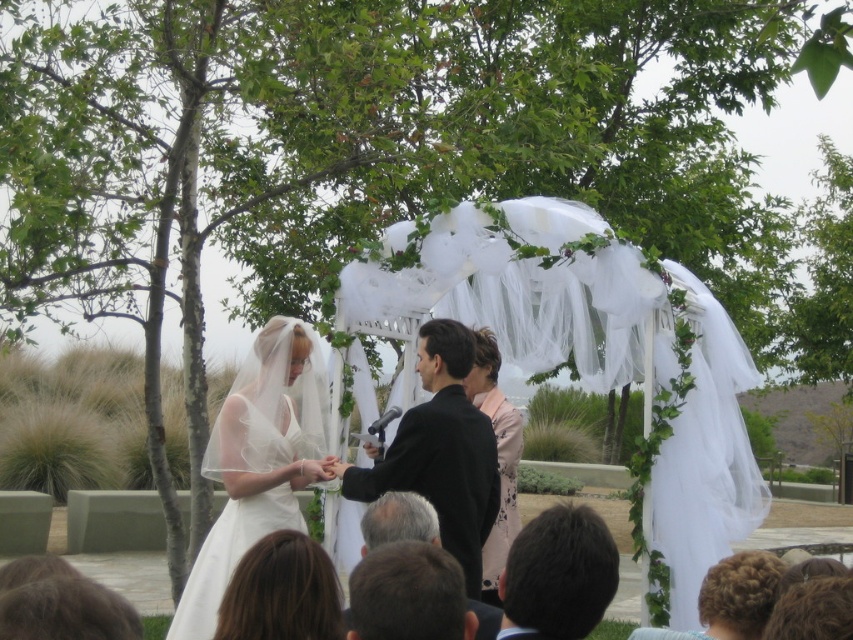
Question: In this image, where is pink floral dress at center located relative to gray hair at lower center?

Choices:
 (A) below
 (B) above

Answer: (B)

Question: Is black smooth suit at center closer to camera compared to pink floral dress at center?

Choices:
 (A) no
 (B) yes

Answer: (B)

Question: Is black smooth suit at center bigger than pink floral dress at center?

Choices:
 (A) no
 (B) yes

Answer: (B)

Question: Which object is farther from the camera taking this photo?

Choices:
 (A) dark brown hair at lower center
 (B) gray hair at lower center
 (C) blonde hair at lower center
 (D) white satin dress at center

Answer: (D)

Question: Which point appears farthest from the camera in this image?

Choices:
 (A) (496, 404)
 (B) (419, 499)
 (C) (451, 481)
 (D) (532, 637)

Answer: (A)

Question: Which is farther from the gray hair at lower center?

Choices:
 (A) black satin suit at center
 (B) white satin dress at center

Answer: (B)